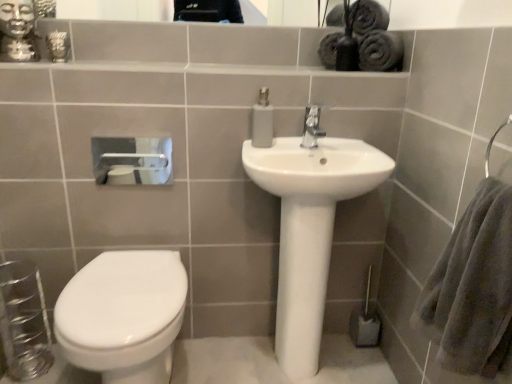
Image resolution: width=512 pixels, height=384 pixels. I want to click on empty space that is to the right of matte gray plastic soap dispenser at upper center, so click(x=310, y=142).